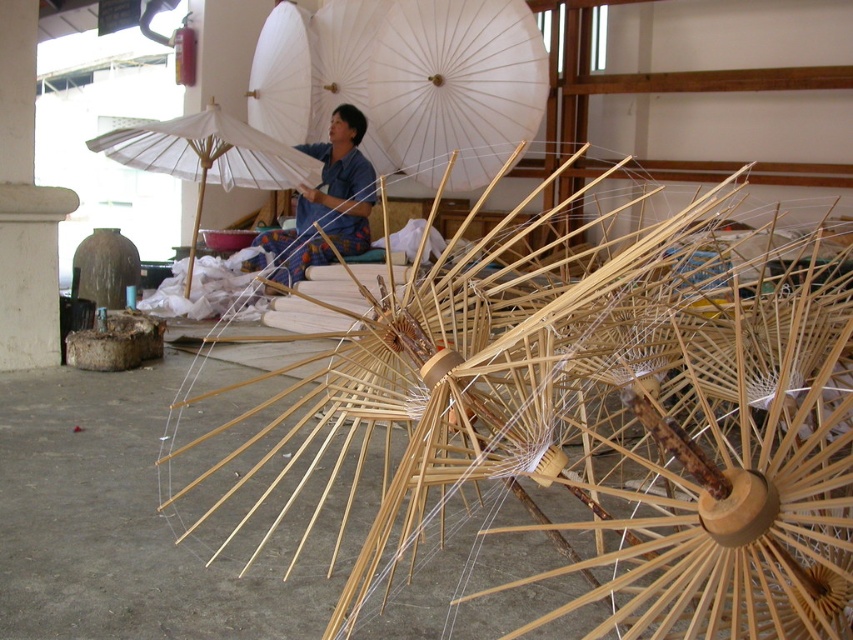
Question: Is white paper umbrella at center wider than white paper umbrella at upper center?

Choices:
 (A) yes
 (B) no

Answer: (A)

Question: From the image, what is the correct spatial relationship of white paper umbrella at center in relation to white paper umbrella at upper center?

Choices:
 (A) above
 (B) below

Answer: (A)

Question: Which of these objects is positioned farthest from the blue fabric at center?

Choices:
 (A) white paper umbrella at center
 (B) white paper umbrella at upper center

Answer: (A)

Question: Among these objects, which one is nearest to the camera?

Choices:
 (A) blue fabric at center
 (B) white paper umbrella at center
 (C) white paper umbrella at upper center

Answer: (C)

Question: Which object is the closest to the blue fabric at center?

Choices:
 (A) white paper umbrella at upper center
 (B) white paper umbrella at center

Answer: (A)

Question: Is white paper umbrella at center smaller than blue fabric at center?

Choices:
 (A) no
 (B) yes

Answer: (A)